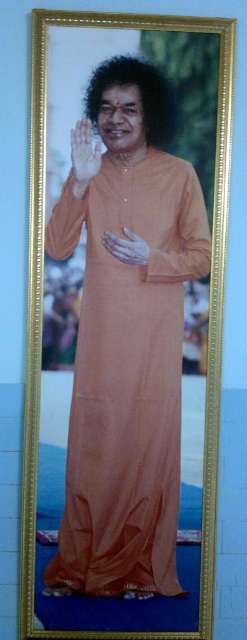
Question: Is curly hair at center further to camera compared to translucent skin hand at center?

Choices:
 (A) no
 (B) yes

Answer: (A)

Question: Is curly hair at center positioned at the back of translucent skin hand at center?

Choices:
 (A) yes
 (B) no

Answer: (B)

Question: Considering the real-world distances, which object is closest to the translucent skin hand at center?

Choices:
 (A) curly hair at center
 (B) matte orange hand at center

Answer: (A)

Question: Estimate the real-world distances between objects in this image. Which object is closer to the translucent skin hand at center?

Choices:
 (A) matte orange hand at center
 (B) curly hair at center

Answer: (B)

Question: Does translucent skin hand at center appear on the left side of matte orange hand at center?

Choices:
 (A) yes
 (B) no

Answer: (A)

Question: Which point is closer to the camera?

Choices:
 (A) (74, 144)
 (B) (121, 253)
 (C) (141, 104)

Answer: (A)